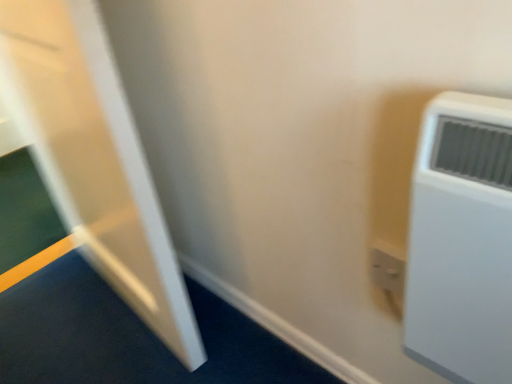
Where is `white glossy door at left`? The width and height of the screenshot is (512, 384). white glossy door at left is located at coordinates (93, 158).

What do you see at coordinates (93, 158) in the screenshot? This screenshot has height=384, width=512. I see `white glossy door at left` at bounding box center [93, 158].

Where is `white glossy door at left`? white glossy door at left is located at coordinates (93, 158).